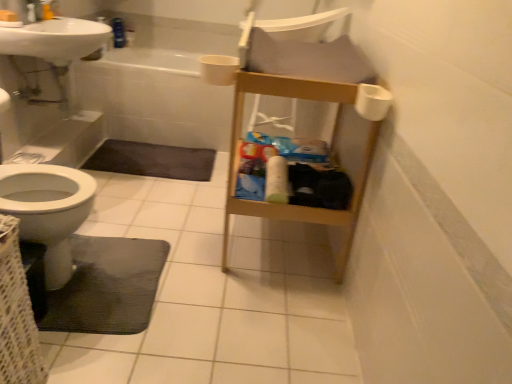
Image resolution: width=512 pixels, height=384 pixels. In order to click on unoccupied space behind black rubber bath mat at lower left, which is the 1th bath mat in front-to-back order in this screenshot , I will do `click(152, 213)`.